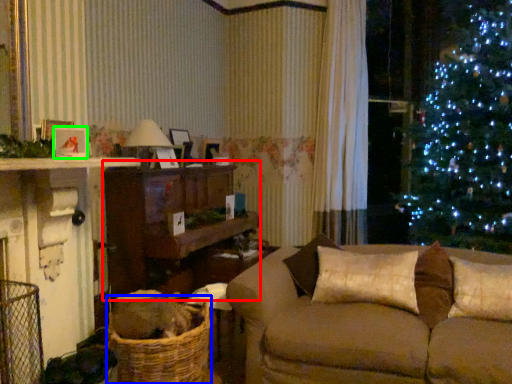
Question: Which object is the closest to the entertainment center (highlighted by a red box)? Choose among these: basket (highlighted by a blue box) or picture frame (highlighted by a green box).

Choices:
 (A) basket
 (B) picture frame

Answer: (A)